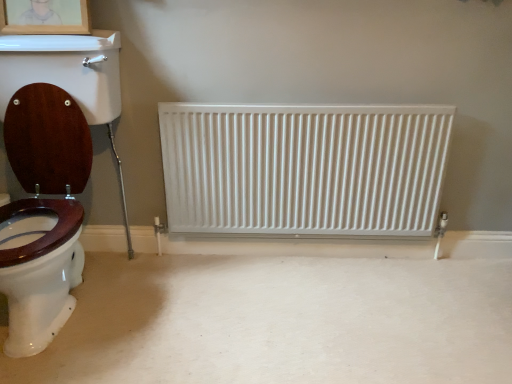
Find the location of `free space in front of white matte radiator at center`. free space in front of white matte radiator at center is located at coordinates (318, 325).